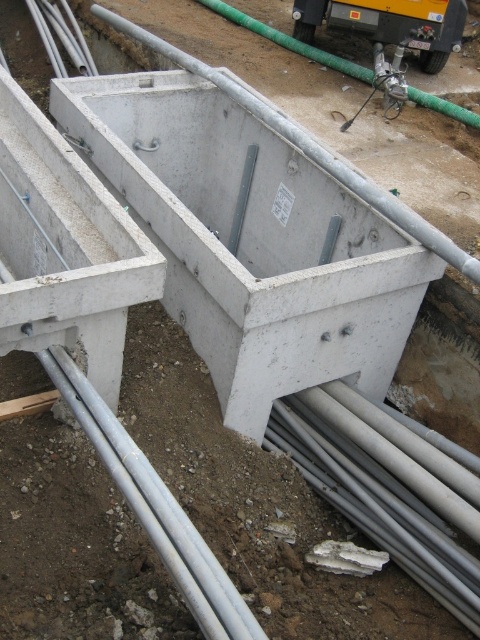
Question: Which point appears closest to the camera in this image?

Choices:
 (A) (124, 465)
 (B) (394, 221)
 (C) (388, 33)

Answer: (A)

Question: Is the position of silver metallic pipes at lower center more distant than that of concrete at center?

Choices:
 (A) yes
 (B) no

Answer: (B)

Question: Estimate the real-world distances between objects in this image. Which object is farther from the silver metallic pipes at lower center?

Choices:
 (A) matte green hose at upper right
 (B) concrete at center

Answer: (A)

Question: Can you confirm if silver metallic pipes at lower center is positioned to the left of matte green hose at upper right?

Choices:
 (A) yes
 (B) no

Answer: (A)

Question: Which of the following is the farthest from the observer?

Choices:
 (A) (79, 397)
 (B) (99, 13)

Answer: (B)

Question: Can you confirm if silver metallic pipes at lower center is smaller than matte green hose at upper right?

Choices:
 (A) yes
 (B) no

Answer: (A)